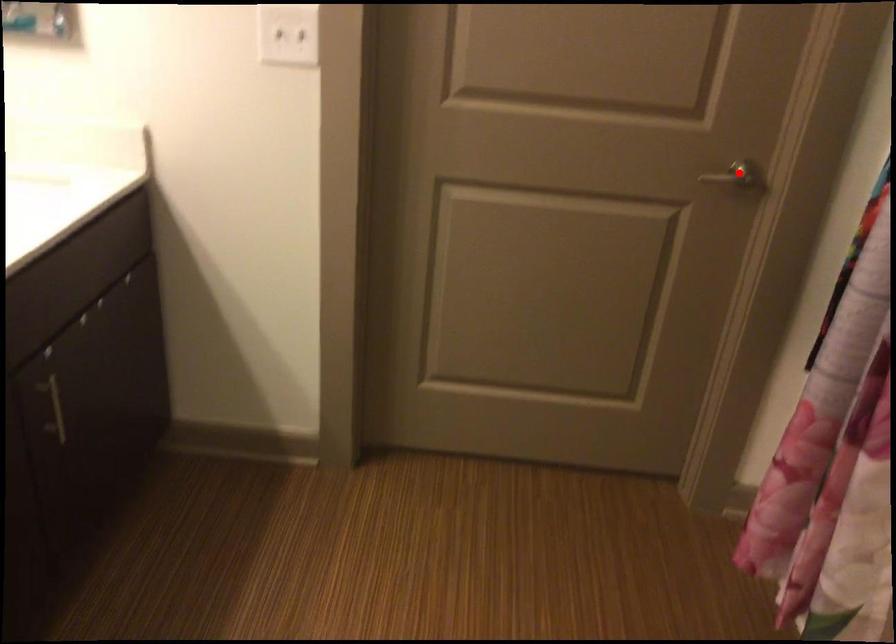
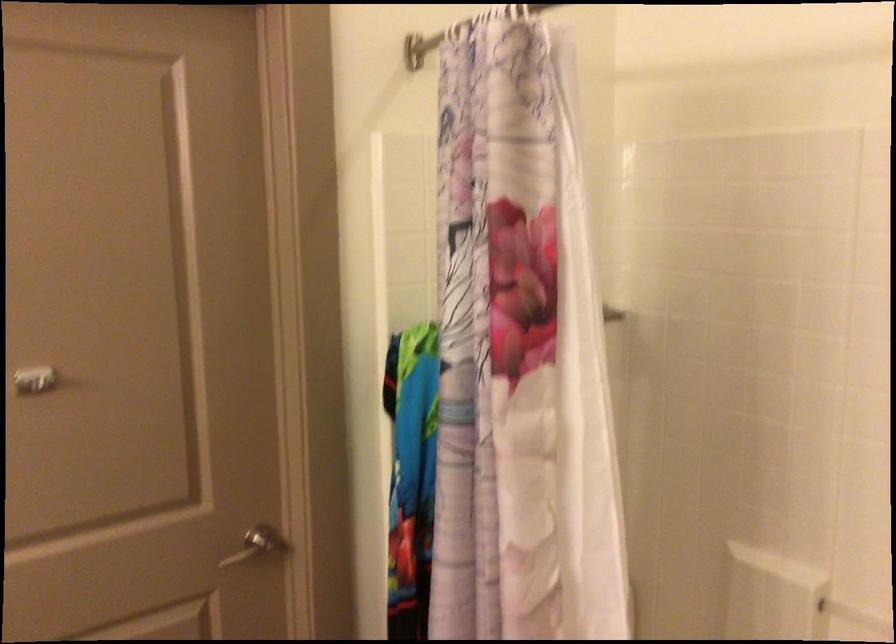
The point at the highlighted location is marked in the first image. Where is the corresponding point in the second image?

(257, 545)